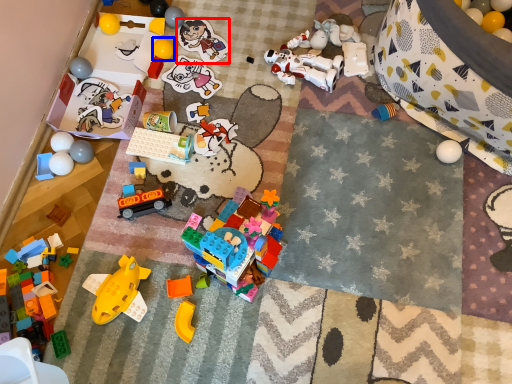
Question: Which object is further to the camera taking this photo, toy (highlighted by a red box) or toy (highlighted by a blue box)?

Choices:
 (A) toy
 (B) toy

Answer: (A)